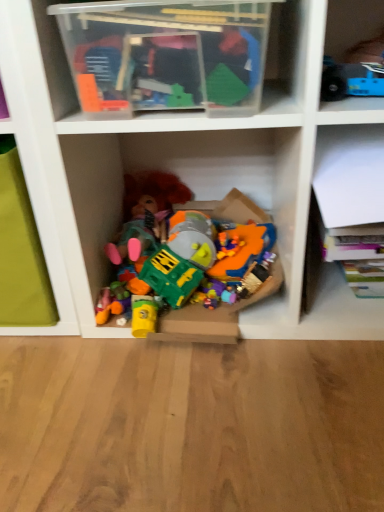
Question: In which direction should I rotate to look at plastic toys at center, the first toy when ordered from bottom to top?

Choices:
 (A) left
 (B) right

Answer: (B)

Question: From the image's perspective, is plastic toys at center, the second toy when ordered from front to back, on blue plastic toy at upper right, marked as the 2th toy in a left-to-right arrangement?

Choices:
 (A) no
 (B) yes

Answer: (A)

Question: Considering the relative positions of plastic toys at center, the 1th toy in the back-to-front sequence, and blue plastic toy at upper right, the 1th toy from the front, in the image provided, is plastic toys at center, the 1th toy in the back-to-front sequence, to the right of blue plastic toy at upper right, the 1th toy from the front, from the viewer's perspective?

Choices:
 (A) yes
 (B) no

Answer: (B)

Question: Is plastic toys at center, acting as the second toy starting from the right, in front of blue plastic toy at upper right, which appears as the second toy when viewed from the back?

Choices:
 (A) yes
 (B) no

Answer: (B)

Question: Is plastic toys at center, which is the 2th toy from top to bottom, looking in the opposite direction of blue plastic toy at upper right, the first toy from the top?

Choices:
 (A) yes
 (B) no

Answer: (B)

Question: Does plastic toys at center, acting as the second toy starting from the right, have a lesser height compared to blue plastic toy at upper right, marked as the 2th toy in a left-to-right arrangement?

Choices:
 (A) yes
 (B) no

Answer: (B)

Question: Is plastic toys at center, the 1th toy in the back-to-front sequence, next to blue plastic toy at upper right, the second toy when ordered from bottom to top?

Choices:
 (A) yes
 (B) no

Answer: (B)

Question: From a real-world perspective, is blue plastic toy at upper right, the second toy when ordered from bottom to top, on top of transparent plastic container at upper center, which appears as the 1th shelf when viewed from the top?

Choices:
 (A) yes
 (B) no

Answer: (B)

Question: Is the depth of blue plastic toy at upper right, the first toy from the top, greater than that of transparent plastic container at upper center, the second shelf from the bottom?

Choices:
 (A) no
 (B) yes

Answer: (B)

Question: Is blue plastic toy at upper right, marked as the 2th toy in a left-to-right arrangement, shorter than transparent plastic container at upper center, which appears as the 1th shelf when viewed from the top?

Choices:
 (A) no
 (B) yes

Answer: (B)

Question: Can you see blue plastic toy at upper right, marked as the 2th toy in a left-to-right arrangement, touching transparent plastic container at upper center, the second shelf from the right?

Choices:
 (A) no
 (B) yes

Answer: (A)

Question: Does blue plastic toy at upper right, the second toy when ordered from bottom to top, have a lesser width compared to transparent plastic container at upper center, the second shelf from the right?

Choices:
 (A) yes
 (B) no

Answer: (A)

Question: From the image's perspective, would you say blue plastic toy at upper right, the 1th toy in the right-to-left sequence, is shown under transparent plastic container at upper center, which appears as the 1th shelf when viewed from the top?

Choices:
 (A) yes
 (B) no

Answer: (A)

Question: Is transparent plastic container at upper center, which appears as the 1th shelf when viewed from the top, turned away from blue plastic toy at upper right, the 1th toy from the front?

Choices:
 (A) yes
 (B) no

Answer: (B)